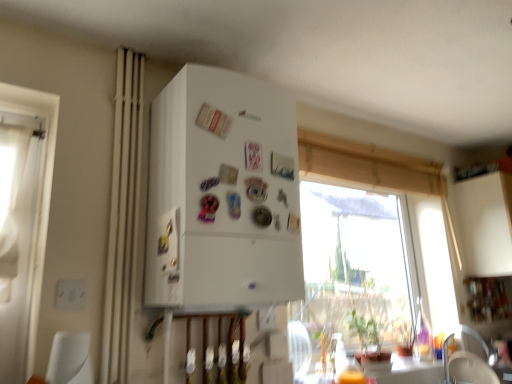
Question: Is white matte refrigerator at center located within transparent glass window at upper center?

Choices:
 (A) yes
 (B) no

Answer: (B)

Question: Does transparent glass window at upper center lie behind white matte refrigerator at center?

Choices:
 (A) yes
 (B) no

Answer: (A)

Question: Can we say transparent glass window at upper center lies outside white matte refrigerator at center?

Choices:
 (A) yes
 (B) no

Answer: (A)

Question: Is transparent glass window at upper center turned away from white matte refrigerator at center?

Choices:
 (A) no
 (B) yes

Answer: (A)

Question: Can you confirm if transparent glass window at upper center is wider than white matte refrigerator at center?

Choices:
 (A) no
 (B) yes

Answer: (A)

Question: Is transparent glass window at upper center in front of white matte refrigerator at center?

Choices:
 (A) yes
 (B) no

Answer: (B)

Question: Considering the relative sizes of transparent glass window at upper center and beige fabric curtain at left in the image provided, is transparent glass window at upper center shorter than beige fabric curtain at left?

Choices:
 (A) no
 (B) yes

Answer: (B)

Question: Can you confirm if transparent glass window at upper center is positioned to the left of beige fabric curtain at left?

Choices:
 (A) no
 (B) yes

Answer: (A)

Question: From a real-world perspective, is transparent glass window at upper center beneath beige fabric curtain at left?

Choices:
 (A) no
 (B) yes

Answer: (A)

Question: Is the depth of transparent glass window at upper center less than that of beige fabric curtain at left?

Choices:
 (A) no
 (B) yes

Answer: (A)

Question: Is transparent glass window at upper center further to the viewer compared to beige fabric curtain at left?

Choices:
 (A) yes
 (B) no

Answer: (A)

Question: Are transparent glass window at upper center and beige fabric curtain at left located far from each other?

Choices:
 (A) yes
 (B) no

Answer: (A)

Question: Are white fabric armchair at lower right and white matte refrigerator at center far apart?

Choices:
 (A) no
 (B) yes

Answer: (B)